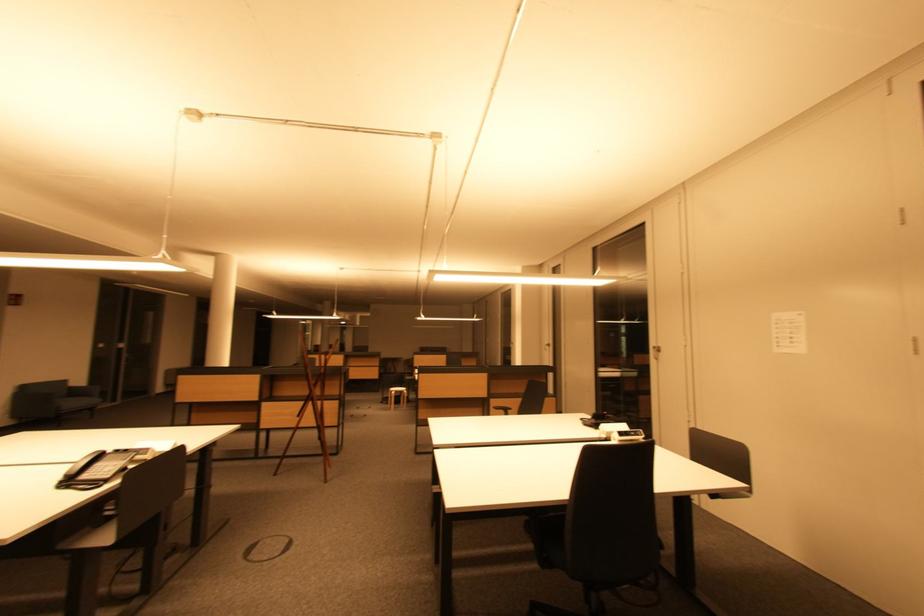
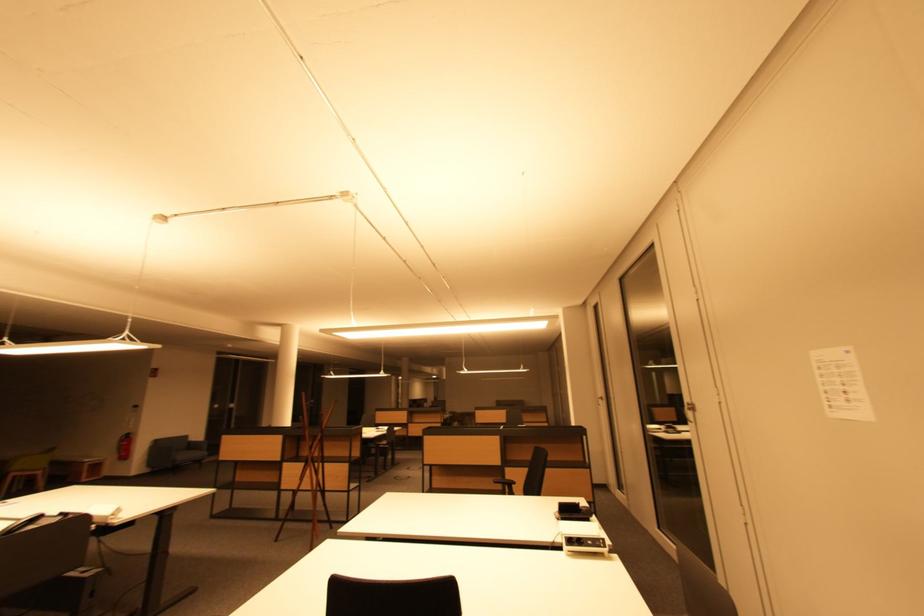
The images are taken continuously from a first-person perspective. In which direction are you moving?

The cameraman moved toward right, forward.